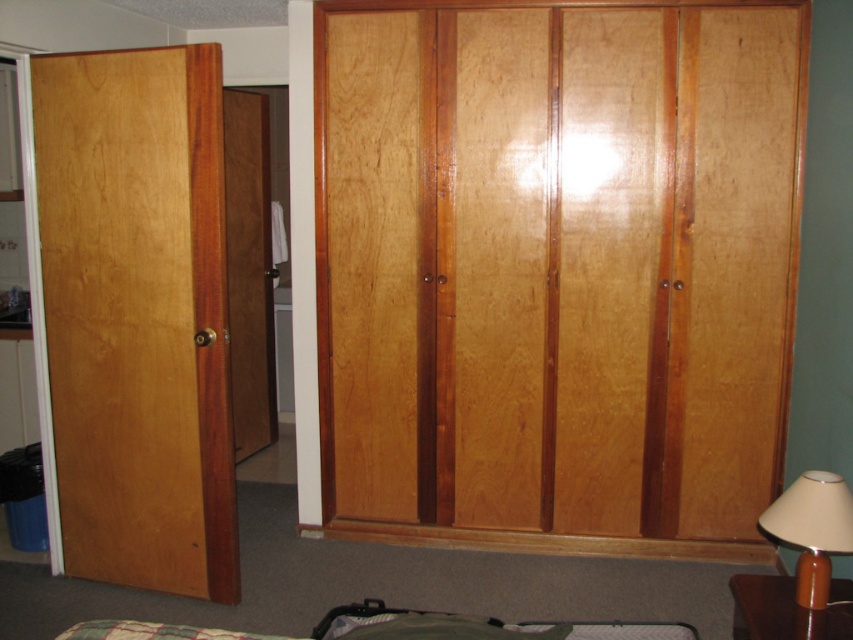
You are trying to find the bathroom in the house. You see the light brown wood door at left and the brown matte lamp at lower right. Which one is closer to the floor?

The brown matte lamp at lower right is closer to the floor because the light brown wood door at left is located above it.

You are moving a brown matte lamp at lower right into the room and need to place it in front of the light brown wood door at left. Is this possible without moving the door?

The brown matte lamp at lower right is currently behind the light brown wood door at left, so to place it in front of the door without moving the door, you would need to move the lamp around the door or through another opening. However, since the door is part of the room structure, physically placing the lamp directly in front might not be possible unless there is space beside the door or the door can be opened to allow the lamp to be positioned in front.